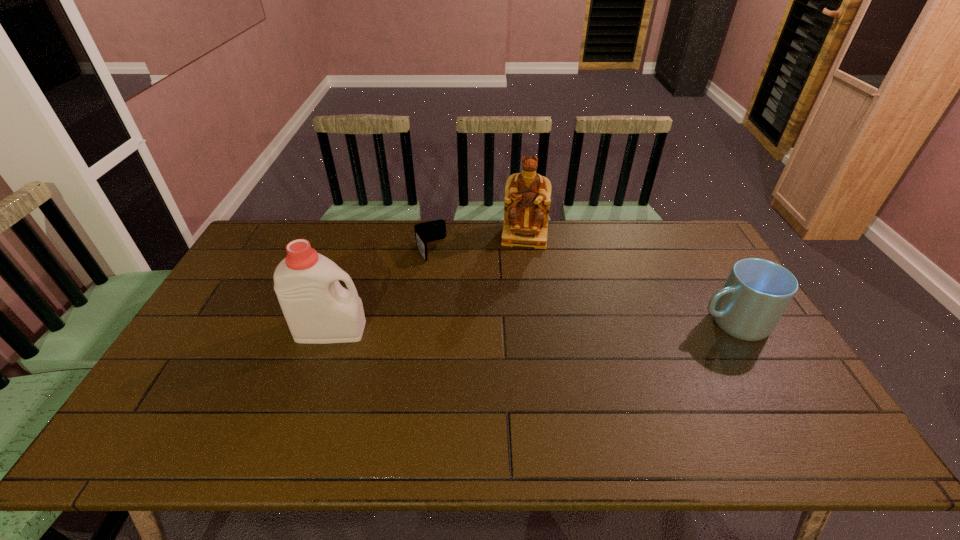
The height and width of the screenshot is (540, 960). Find the location of `vacant space on the desktop that is between the detergent and the rightmost object and is positioned on the front-facing side of the figurine`. vacant space on the desktop that is between the detergent and the rightmost object and is positioned on the front-facing side of the figurine is located at coordinates (514, 327).

At what (x,y) coordinates should I click in order to perform the action: click on free space on the desktop that is between the leftmost object and the mug and is positioned on the outer surface of the wallet. Please return your answer as a coordinate pair (x, y). Looking at the image, I should click on (474, 328).